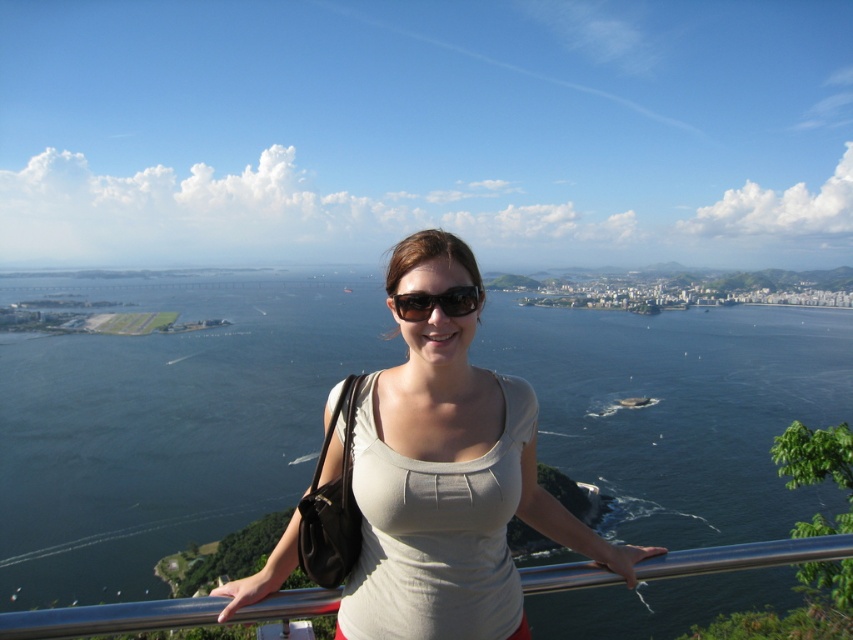
Can you confirm if dark blue water at center is bigger than white matte tank top at center?

Yes, dark blue water at center is bigger than white matte tank top at center.

Does dark blue water at center appear under white matte tank top at center?

Indeed, dark blue water at center is positioned under white matte tank top at center.

What are the coordinates of `dark blue water at center` in the screenshot? It's located at (165, 422).

Between stainless steel railing at center and black plastic sunglasses at center, which one has more height?

Standing taller between the two is stainless steel railing at center.

Locate an element on the screen. stainless steel railing at center is located at coordinates (109, 618).

Where is `stainless steel railing at center`? Image resolution: width=853 pixels, height=640 pixels. stainless steel railing at center is located at coordinates (109, 618).

Is point (339, 452) less distant than point (445, 292)?

Yes.

Does white matte tank top at center appear on the left side of black plastic sunglasses at center?

Incorrect, white matte tank top at center is not on the left side of black plastic sunglasses at center.

Locate an element on the screen. This screenshot has height=640, width=853. white matte tank top at center is located at coordinates (448, 476).